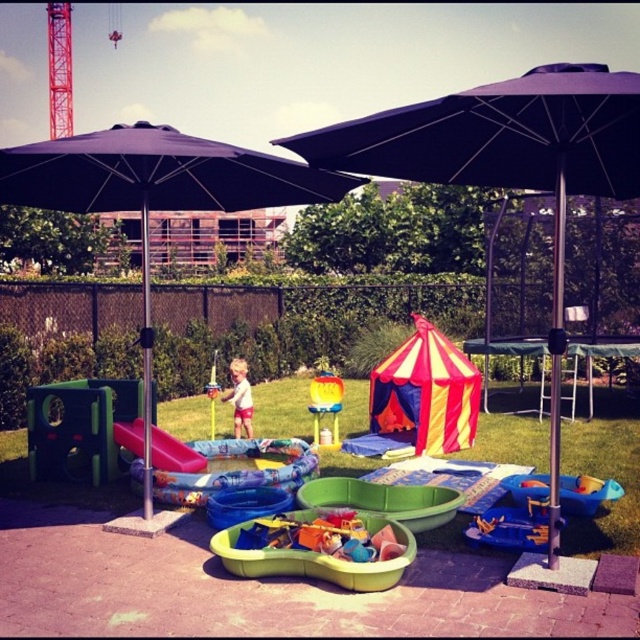
Can you confirm if striped fabric tent at center is taller than green plastic sandbox at center?

Yes, striped fabric tent at center is taller than green plastic sandbox at center.

Looking at this image, who is more distant from viewer, (472, 388) or (392, 577)?

Point (472, 388)

Where is `striped fabric tent at center`? Image resolution: width=640 pixels, height=640 pixels. striped fabric tent at center is located at coordinates (426, 392).

Consider the image. Can you confirm if red painted metal tower at upper left is taller than blue plastic bucket at lower right?

Yes.

Does point (52, 35) come in front of point (509, 477)?

No, it is behind (509, 477).

Who is more distant from viewer, (x=68, y=60) or (x=588, y=490)?

Point (x=68, y=60)

Locate an element on the screen. Image resolution: width=640 pixels, height=640 pixels. red painted metal tower at upper left is located at coordinates (60, 68).

Does striped fabric tent at center have a smaller size compared to orange plastic bucket at center?

No, striped fabric tent at center is not smaller than orange plastic bucket at center.

Does point (417, 408) come closer to viewer compared to point (509, 538)?

No.

Is point (401, 403) closer to camera compared to point (502, 508)?

No, (401, 403) is behind (502, 508).

You are a GUI agent. You are given a task and a screenshot of the screen. Output one action in this format:
    pyautogui.click(x=<x>, y=<y>)
    Task: Click on the striped fabric tent at center
    
    Given the screenshot: What is the action you would take?
    pyautogui.click(x=426, y=392)